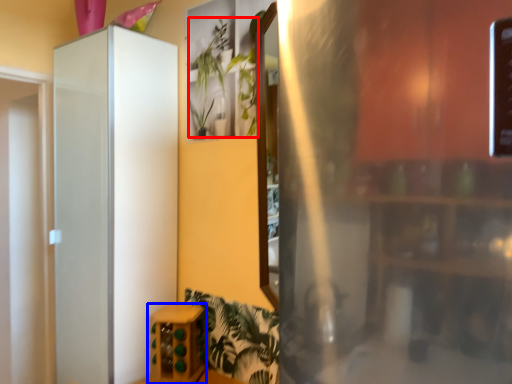
Question: Which of the following is the farthest to the observer, plant (highlighted by a red box) or furniture (highlighted by a blue box)?

Choices:
 (A) plant
 (B) furniture

Answer: (B)